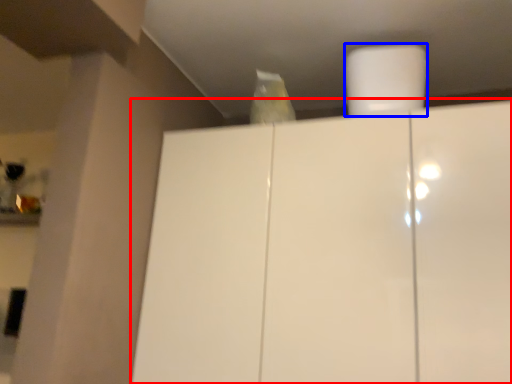
Question: Which point is closer to the camera, cupboard (highlighted by a red box) or paper towel (highlighted by a blue box)?

Choices:
 (A) cupboard
 (B) paper towel

Answer: (A)